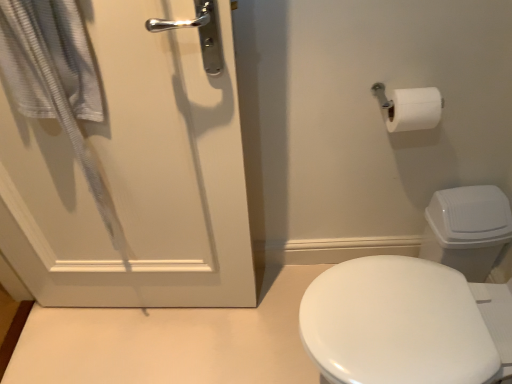
Question: Is white matte door at left shorter than white plastic toilet bowl at right?

Choices:
 (A) no
 (B) yes

Answer: (A)

Question: Does white matte door at left have a lesser width compared to white plastic toilet bowl at right?

Choices:
 (A) no
 (B) yes

Answer: (B)

Question: Are white matte door at left and white plastic toilet bowl at right beside each other?

Choices:
 (A) no
 (B) yes

Answer: (A)

Question: Considering the relative positions of white matte door at left and white plastic toilet bowl at right in the image provided, is white matte door at left in front of white plastic toilet bowl at right?

Choices:
 (A) yes
 (B) no

Answer: (A)

Question: Is white matte door at left positioned behind white plastic toilet bowl at right?

Choices:
 (A) no
 (B) yes

Answer: (A)

Question: Does white matte door at left appear on the left side of white plastic toilet bowl at right?

Choices:
 (A) yes
 (B) no

Answer: (A)

Question: From the image's perspective, is white textured towel at left below white plastic toilet bowl at right?

Choices:
 (A) no
 (B) yes

Answer: (A)

Question: From the image's perspective, is white textured towel at left over white plastic toilet bowl at right?

Choices:
 (A) no
 (B) yes

Answer: (B)

Question: Does white textured towel at left have a greater height compared to white plastic toilet bowl at right?

Choices:
 (A) yes
 (B) no

Answer: (A)

Question: Can you confirm if white textured towel at left is wider than white plastic toilet bowl at right?

Choices:
 (A) yes
 (B) no

Answer: (B)

Question: Is white textured towel at left positioned with its back to white plastic toilet bowl at right?

Choices:
 (A) yes
 (B) no

Answer: (B)

Question: Can you confirm if white textured towel at left is positioned to the left of white plastic toilet bowl at right?

Choices:
 (A) no
 (B) yes

Answer: (B)

Question: Can you confirm if white plastic toilet bowl at right is wider than white matte door at left?

Choices:
 (A) yes
 (B) no

Answer: (A)